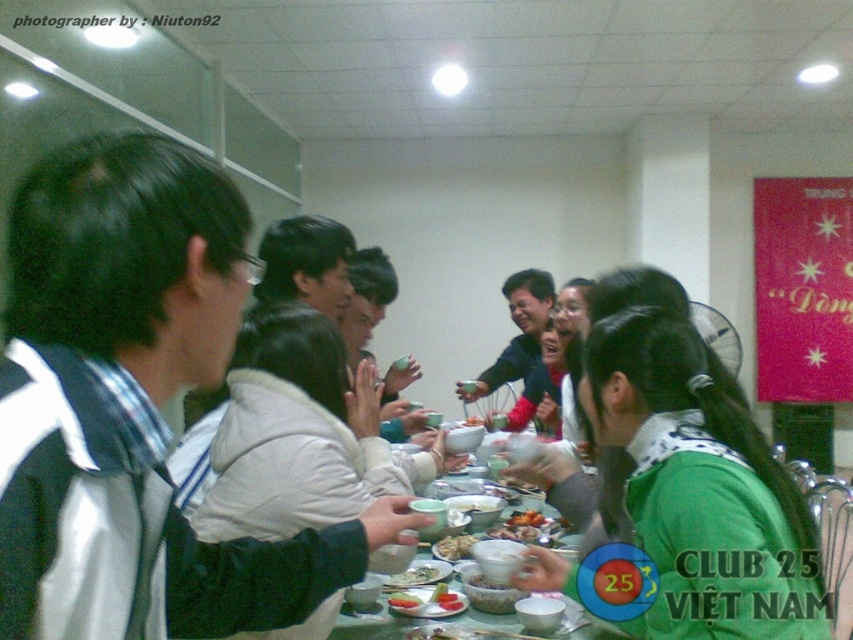
Between point (653, 620) and point (451, 552), which one is positioned in front?

Positioned in front is point (653, 620).

Is point (631, 589) farther from viewer compared to point (445, 547)?

That is False.

Image resolution: width=853 pixels, height=640 pixels. Identify the location of green matte shirt at center. (688, 497).

Where is `green matte shirt at center`? green matte shirt at center is located at coordinates (688, 497).

Between point (746, 493) and point (418, 602), which one is positioned behind?

The point (418, 602) is behind.

Between green matte shirt at center and smooth white bowl at center, which one has more height?

green matte shirt at center

Consider the image. Who is more forward, (779, 552) or (405, 604)?

Positioned in front is point (779, 552).

Find the location of a particular element. Image resolution: width=853 pixels, height=640 pixels. green matte shirt at center is located at coordinates (688, 497).

Is green matte shirt at center positioned before green glossy table at center?

Yes, it is.

Who is taller, green matte shirt at center or green glossy table at center?

Standing taller between the two is green matte shirt at center.

Is point (677, 488) closer to viewer compared to point (570, 545)?

That is True.

Where is `green matte shirt at center`? green matte shirt at center is located at coordinates (688, 497).